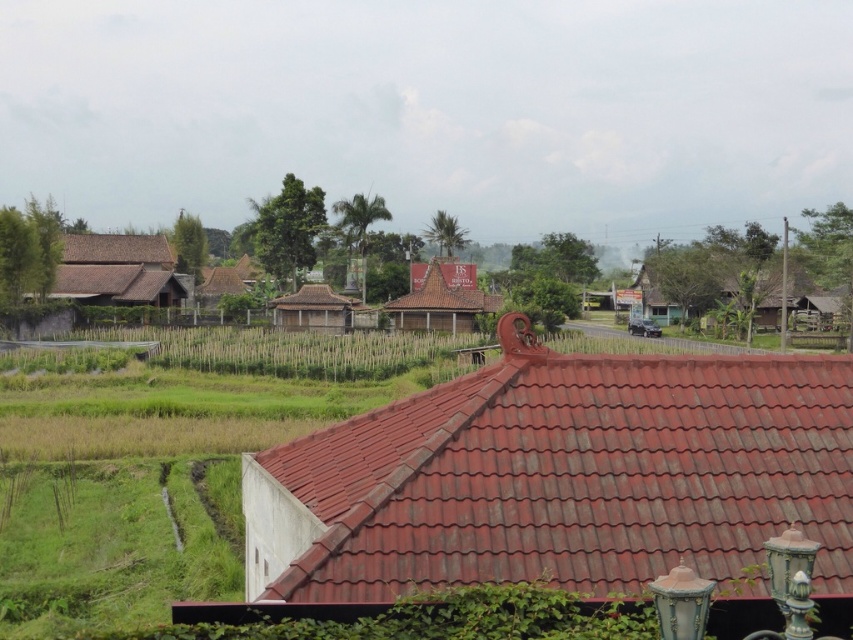
Question: Does brown textured hut at center appear under brown wooden hut at center?

Choices:
 (A) no
 (B) yes

Answer: (A)

Question: Among these objects, which one is nearest to the camera?

Choices:
 (A) red tile roof at center
 (B) brown wooden hut at center

Answer: (A)

Question: Which is nearer to the red tile roof at center?

Choices:
 (A) brown textured hut at center
 (B) brown wooden hut at center
 (C) brown tile roof at left

Answer: (B)

Question: Does brown tile roof at left appear on the right side of brown wooden hut at center?

Choices:
 (A) no
 (B) yes

Answer: (A)

Question: Which point appears closest to the camera in this image?

Choices:
 (A) (111, 262)
 (B) (335, 323)
 (C) (428, 278)

Answer: (C)

Question: From the image, what is the correct spatial relationship of red tile roof at center in relation to brown wooden hut at center?

Choices:
 (A) right
 (B) left

Answer: (A)